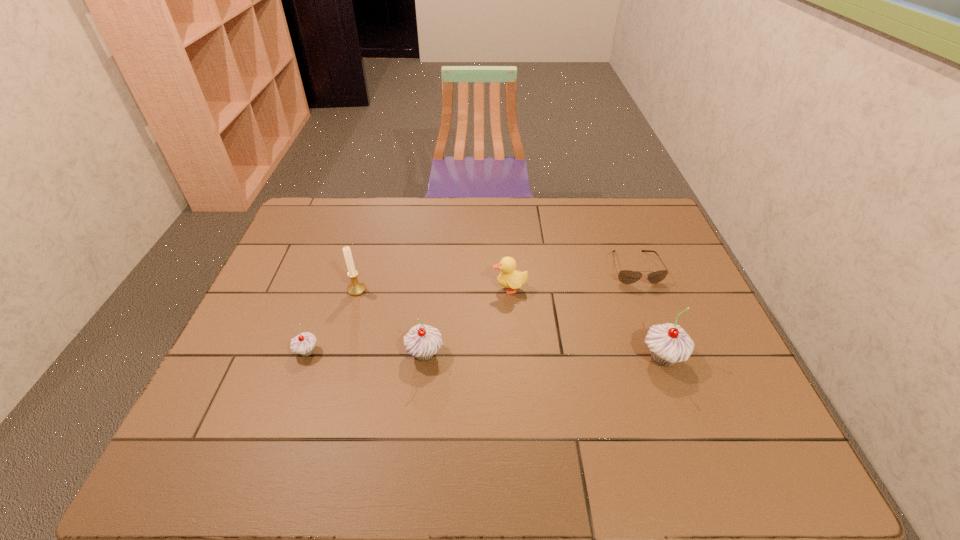
I want to click on vacant space that's between the duckling and the leftmost object, so click(408, 320).

Find the location of a particular element. free space between the second tallest cupcake and the shortest cupcake is located at coordinates point(366,353).

Identify the location of vacant area that lies between the third object from right to left and the leftmost object. (408, 320).

In order to click on free spot between the fifth object from right to left and the second cupcake from left to right in this screenshot , I will do `click(391, 322)`.

Where is `vacant point located between the shortest object and the rightmost cupcake`? vacant point located between the shortest object and the rightmost cupcake is located at coordinates (649, 313).

Choose which object is the fifth nearest neighbor to the second shortest cupcake. Please provide its 2D coordinates. Your answer should be formatted as a tuple, i.e. [(x, y)], where the tuple contains the x and y coordinates of a point satisfying the conditions above.

[(625, 276)]

Choose which object is the nearest neighbor to the sunglasses. Please provide its 2D coordinates. Your answer should be formatted as a tuple, i.e. [(x, y)], where the tuple contains the x and y coordinates of a point satisfying the conditions above.

[(668, 343)]

The image size is (960, 540). Find the location of `the second closest cupcake to the second shortest object`. the second closest cupcake to the second shortest object is located at coordinates (668, 343).

At what (x,y) coordinates should I click in order to perform the action: click on cupcake that stands as the second closest to the shortest cupcake. Please return your answer as a coordinate pair (x, y). The width and height of the screenshot is (960, 540). Looking at the image, I should click on (668, 343).

Find the location of `vacant space that satisfies the following two spatial constraints: 1. on the front-facing side of the shortest object; 2. on the front-facing side of the fourth object from left to right`. vacant space that satisfies the following two spatial constraints: 1. on the front-facing side of the shortest object; 2. on the front-facing side of the fourth object from left to right is located at coordinates (642, 288).